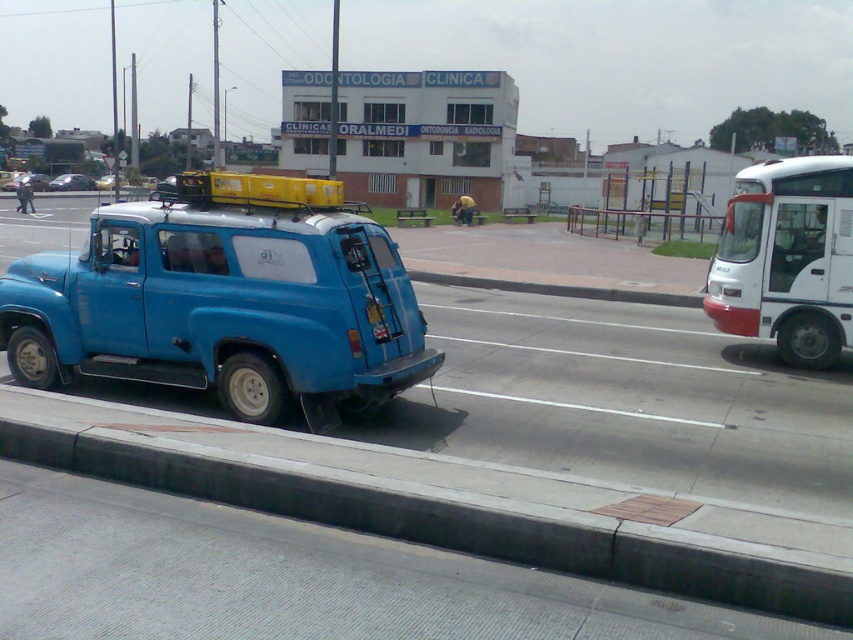
Does matte blue van at left appear over metallic blue van at center?

No, matte blue van at left is not above metallic blue van at center.

Is matte blue van at left below metallic blue van at center?

Yes, matte blue van at left is below metallic blue van at center.

Between point (329, 212) and point (64, 173), which one is positioned in front?

Point (329, 212)

The width and height of the screenshot is (853, 640). In order to click on matte blue van at left in this screenshot , I will do `click(225, 300)`.

Who is shorter, matte blue van at left or gray concrete curb at lower left?

gray concrete curb at lower left

Does matte blue van at left have a greater height compared to gray concrete curb at lower left?

Yes, matte blue van at left is taller than gray concrete curb at lower left.

Which is in front, point (196, 234) or point (189, 413)?

Positioned in front is point (189, 413).

I want to click on matte blue van at left, so click(225, 300).

Based on the photo, does white glossy bus at right have a larger size compared to blue matte van at center?

No, white glossy bus at right is not bigger than blue matte van at center.

Does white glossy bus at right have a lesser height compared to blue matte van at center?

Yes, white glossy bus at right is shorter than blue matte van at center.

Does point (735, 236) come farther from viewer compared to point (120, 180)?

No.

Image resolution: width=853 pixels, height=640 pixels. I want to click on white glossy bus at right, so click(787, 259).